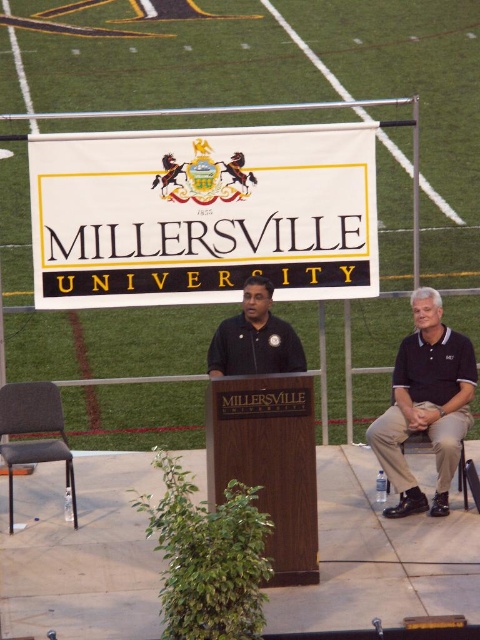
Who is more distant from viewer, (147,131) or (420,428)?

The point (147,131) is more distant.

Can you confirm if white fabric sign at center is shorter than dark blue polo shirt at right?

Yes.

Between point (78, 296) and point (371, 445), which one is positioned behind?

Point (78, 296)

Identify the location of white fabric sign at center. [203, 214].

Based on the photo, is dark blue polo shirt at right shorter than black smooth shirt at center?

In fact, dark blue polo shirt at right may be taller than black smooth shirt at center.

Does dark blue polo shirt at right lie behind black smooth shirt at center?

Yes, it is behind black smooth shirt at center.

Is point (396, 384) farther from viewer compared to point (271, 294)?

That is True.

Locate an element on the screen. This screenshot has height=640, width=480. dark blue polo shirt at right is located at coordinates (425, 404).

Does green artificial turf at upper center lie in front of black smooth shirt at center?

No.

Does point (123, 353) lie in front of point (244, 312)?

No.

Where is `green artificial turf at upper center`? This screenshot has width=480, height=640. green artificial turf at upper center is located at coordinates (282, 67).